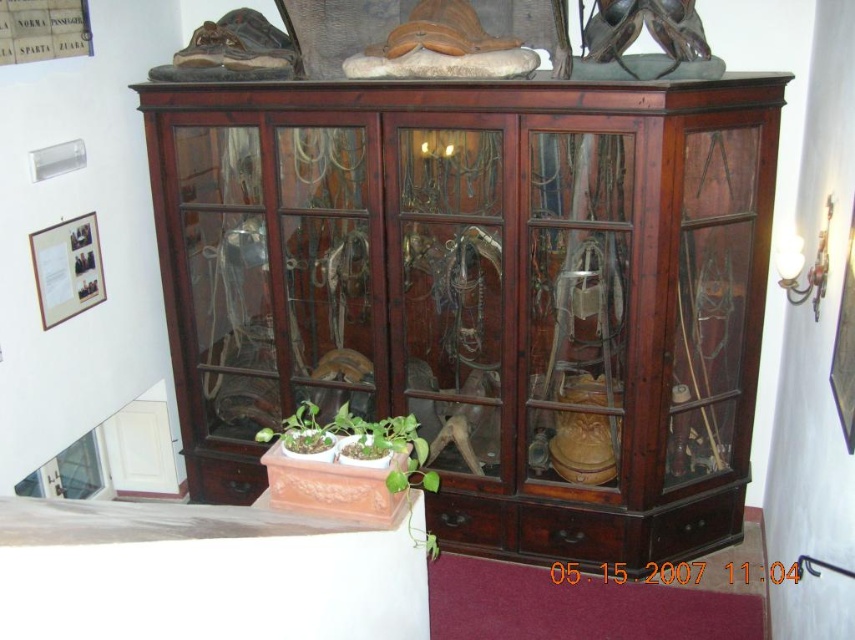
Question: Which of the following is the closest to the observer?

Choices:
 (A) (317, 497)
 (B) (310, 452)

Answer: (B)

Question: Is green matte pot at lower center closer to the viewer compared to green matte plant at center?

Choices:
 (A) yes
 (B) no

Answer: (A)

Question: Does green matte pot at lower center appear under green matte plant at center?

Choices:
 (A) yes
 (B) no

Answer: (B)

Question: Considering the relative positions of green matte pot at lower center and green matte plant at center in the image provided, where is green matte pot at lower center located with respect to green matte plant at center?

Choices:
 (A) below
 (B) above

Answer: (B)